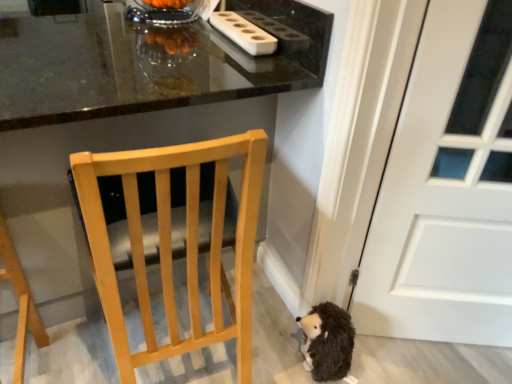
The height and width of the screenshot is (384, 512). What do you see at coordinates (327, 341) in the screenshot?
I see `brown fuzzy hedgehog at lower right` at bounding box center [327, 341].

Measure the distance between point (511, 301) and camera.

Point (511, 301) is 1.40 meters from camera.

This screenshot has height=384, width=512. What do you see at coordinates (134, 89) in the screenshot?
I see `glossy black table at upper center` at bounding box center [134, 89].

The height and width of the screenshot is (384, 512). Describe the element at coordinates (170, 243) in the screenshot. I see `light wood chair at center` at that location.

You are a GUI agent. You are given a task and a screenshot of the screen. Output one action in this format:
    pyautogui.click(x=<x>, y=<y>)
    Task: Click on the white plastic holder at upper center
    The width and height of the screenshot is (512, 384).
    Given the screenshot: What is the action you would take?
    pyautogui.click(x=244, y=33)

Based on the photo, how different are the orientations of white plastic holder at upper center and light wood chair at center in degrees?

89.7 degrees.

From a real-world perspective, who is located lower, white plastic holder at upper center or light wood chair at center?

light wood chair at center is physically lower.

Is white plastic holder at upper center taller than light wood chair at center?

In fact, white plastic holder at upper center may be shorter than light wood chair at center.

From a real-world perspective, is white matte door at right physically below white plastic holder at upper center?

Yes, from a real-world perspective, white matte door at right is below white plastic holder at upper center.

Which object is closer to the camera taking this photo, white matte door at right or white plastic holder at upper center?

white matte door at right is in front.

Is point (482, 341) closer to viewer compared to point (229, 21)?

That is False.

Would you say white plastic holder at upper center is outside glossy black table at upper center?

No.

Who is taller, white plastic holder at upper center or glossy black table at upper center?

Standing taller between the two is glossy black table at upper center.

Is white plastic holder at upper center turned away from glossy black table at upper center?

Correct, white plastic holder at upper center is looking away from glossy black table at upper center.

Is light wood chair at center smaller than white plastic holder at upper center?

No.

Is light wood chair at center aimed at white plastic holder at upper center?

No, light wood chair at center does not turn towards white plastic holder at upper center.

Which object is further away from the camera, light wood chair at center or white plastic holder at upper center?

white plastic holder at upper center is more distant.

Based on the photo, how many degrees apart are the facing directions of light wood chair at center and white plastic holder at upper center?

The angular difference between light wood chair at center and white plastic holder at upper center is 89.7 degrees.

Is point (465, 59) closer to camera compared to point (275, 98)?

Yes, point (465, 59) is in front of point (275, 98).

How many degrees apart are the facing directions of white matte door at right and glossy black table at upper center?

They differ by 146 degrees in their facing directions.

From the picture: From a real-world perspective, is white matte door at right positioned over glossy black table at upper center based on gravity?

Yes, from a real-world perspective, white matte door at right is on top of glossy black table at upper center.

Is white matte door at right looking in the opposite direction of brown fuzzy hedgehog at lower right?

No, white matte door at right is not facing the opposite direction of brown fuzzy hedgehog at lower right.

Is white matte door at right to the left of brown fuzzy hedgehog at lower right from the viewer's perspective?

No, white matte door at right is not to the left of brown fuzzy hedgehog at lower right.

What's the angular difference between white matte door at right and brown fuzzy hedgehog at lower right's facing directions?

108 degrees.

Considering the sizes of objects white matte door at right and brown fuzzy hedgehog at lower right in the image provided, who is shorter, white matte door at right or brown fuzzy hedgehog at lower right?

brown fuzzy hedgehog at lower right is shorter.

From the image's perspective, which is below, light wood chair at center or glossy black table at upper center?

From the image's view, light wood chair at center is below.

Does point (258, 147) come farther from viewer compared to point (133, 98)?

No, (258, 147) is closer to viewer.

Is light wood chair at center positioned in front of glossy black table at upper center?

No.

Measure the distance between light wood chair at center and glossy black table at upper center.

light wood chair at center is 17.26 inches away from glossy black table at upper center.

At what (x,y) coordinates should I click in order to perform the action: click on appliance behind the light wood chair at center. Please return your answer as a coordinate pair (x, y). The width and height of the screenshot is (512, 384). Looking at the image, I should click on point(244,33).

Where is `appliance above the white matte door at right (from the image's perspective)`? The height and width of the screenshot is (384, 512). appliance above the white matte door at right (from the image's perspective) is located at coordinates click(x=244, y=33).

When comparing their distances from glossy black table at upper center, does white plastic holder at upper center or light wood chair at center seem further?

light wood chair at center.

Estimate the real-world distances between objects in this image. Which object is closer to brown fuzzy hedgehog at lower right, white matte door at right or light wood chair at center?

Among the two, white matte door at right is located nearer to brown fuzzy hedgehog at lower right.

Estimate the real-world distances between objects in this image. Which object is further from brown fuzzy hedgehog at lower right, white plastic holder at upper center or light wood chair at center?

white plastic holder at upper center.

Based on their spatial positions, is white matte door at right or glossy black table at upper center closer to white plastic holder at upper center?

A: Based on the image, glossy black table at upper center appears to be nearer to white plastic holder at upper center.

From the image, which object appears to be farther from white plastic holder at upper center, brown fuzzy hedgehog at lower right or white matte door at right?

brown fuzzy hedgehog at lower right is further to white plastic holder at upper center.

Considering their positions, is white plastic holder at upper center positioned closer to glossy black table at upper center than brown fuzzy hedgehog at lower right?

white plastic holder at upper center is positioned closer to the anchor glossy black table at upper center.

Based on their spatial positions, is light wood chair at center or brown fuzzy hedgehog at lower right further from glossy black table at upper center?

brown fuzzy hedgehog at lower right.

Estimate the real-world distances between objects in this image. Which object is closer to glossy black table at upper center, light wood chair at center or white matte door at right?

Among the two, light wood chair at center is located nearer to glossy black table at upper center.

Where is `toy situated between light wood chair at center and white matte door at right from left to right`? This screenshot has width=512, height=384. toy situated between light wood chair at center and white matte door at right from left to right is located at coordinates (327, 341).

The height and width of the screenshot is (384, 512). Find the location of `chair between white plastic holder at upper center and brown fuzzy hedgehog at lower right from top to bottom`. chair between white plastic holder at upper center and brown fuzzy hedgehog at lower right from top to bottom is located at coordinates coord(170,243).

This screenshot has width=512, height=384. I want to click on table between white plastic holder at upper center and brown fuzzy hedgehog at lower right from top to bottom, so click(134, 89).

Where is `appliance situated between glossy black table at upper center and white matte door at right from left to right`? Image resolution: width=512 pixels, height=384 pixels. appliance situated between glossy black table at upper center and white matte door at right from left to right is located at coordinates (244, 33).